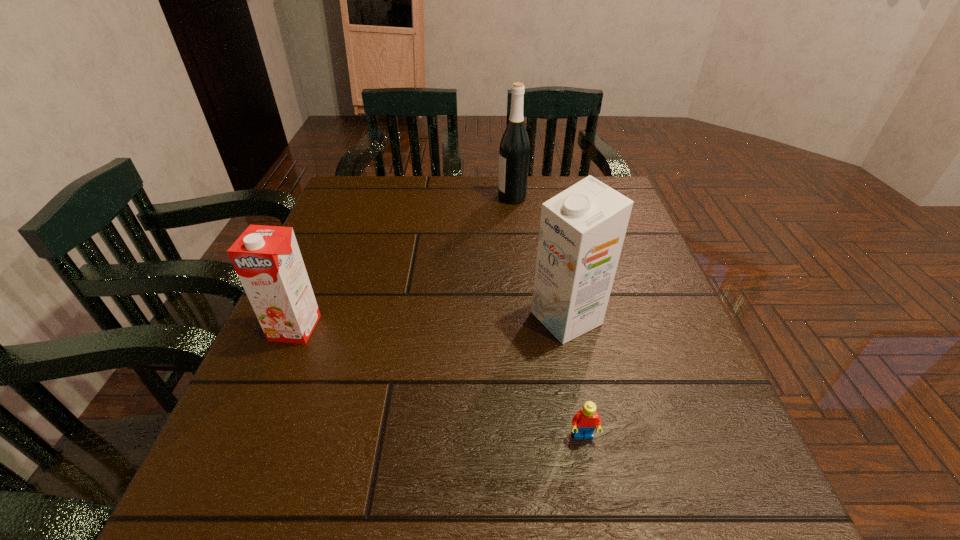
I want to click on wine bottle, so click(x=514, y=151).

Locate an element on the screen. The height and width of the screenshot is (540, 960). the taller carton is located at coordinates (582, 229).

This screenshot has height=540, width=960. In order to click on the left carton in this screenshot , I will do `click(267, 259)`.

Locate an element on the screen. The height and width of the screenshot is (540, 960). the leftmost object is located at coordinates (267, 259).

What are the coordinates of `the nearest object` in the screenshot? It's located at (584, 422).

Find the location of a particular element. The width and height of the screenshot is (960, 540). Lego is located at coordinates (584, 422).

Identify the location of free space located on the label of the farthest object. (437, 198).

Where is `free spot located on the label of the farthest object`? This screenshot has width=960, height=540. free spot located on the label of the farthest object is located at coordinates (469, 198).

This screenshot has height=540, width=960. What are the coordinates of `vacant space situated on the label of the farthest object` in the screenshot? It's located at (430, 198).

This screenshot has width=960, height=540. Find the location of `free space located on the front of the taller carton`. free space located on the front of the taller carton is located at coordinates (584, 405).